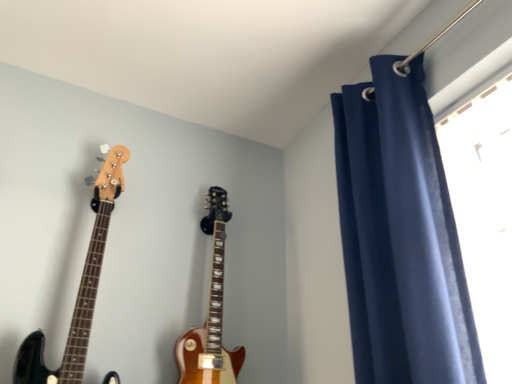
Question: From a real-world perspective, is glossy wood guitar at center, which is the 1th guitar from right to left, under glossy wood guitar at left, acting as the 1th guitar starting from the left?

Choices:
 (A) no
 (B) yes

Answer: (B)

Question: Does glossy wood guitar at center, which is the 1th guitar from right to left, have a smaller size compared to glossy wood guitar at left, the second guitar positioned from the right?

Choices:
 (A) yes
 (B) no

Answer: (A)

Question: Considering the relative sizes of glossy wood guitar at center, which is the 1th guitar from right to left, and glossy wood guitar at left, acting as the 1th guitar starting from the left, in the image provided, is glossy wood guitar at center, which is the 1th guitar from right to left, shorter than glossy wood guitar at left, acting as the 1th guitar starting from the left,?

Choices:
 (A) no
 (B) yes

Answer: (B)

Question: Is glossy wood guitar at center, marked as the 2th guitar in a left-to-right arrangement, to the right of glossy wood guitar at left, the second guitar positioned from the right, from the viewer's perspective?

Choices:
 (A) no
 (B) yes

Answer: (B)

Question: Would you say glossy wood guitar at left, acting as the 1th guitar starting from the left, is part of glossy wood guitar at center, which is the 1th guitar from right to left,'s contents?

Choices:
 (A) no
 (B) yes

Answer: (A)

Question: In the image, is glossy wood guitar at center, which is the 1th guitar from right to left, positioned in front of or behind navy blue velvet curtain at upper right?

Choices:
 (A) front
 (B) behind

Answer: (B)

Question: From their relative heights in the image, would you say glossy wood guitar at center, which is the 1th guitar from right to left, is taller or shorter than navy blue velvet curtain at upper right?

Choices:
 (A) short
 (B) tall

Answer: (A)

Question: Looking at their shapes, would you say glossy wood guitar at center, which is the 1th guitar from right to left, is wider or thinner than navy blue velvet curtain at upper right?

Choices:
 (A) thin
 (B) wide

Answer: (A)

Question: In the image, is glossy wood guitar at center, marked as the 2th guitar in a left-to-right arrangement, on the left side or the right side of navy blue velvet curtain at upper right?

Choices:
 (A) left
 (B) right

Answer: (A)

Question: From the image's perspective, is glossy wood guitar at left, the second guitar positioned from the right, located above or below navy blue velvet curtain at upper right?

Choices:
 (A) below
 (B) above

Answer: (A)

Question: Is glossy wood guitar at left, acting as the 1th guitar starting from the left, inside or outside of navy blue velvet curtain at upper right?

Choices:
 (A) outside
 (B) inside

Answer: (A)

Question: From a real-world perspective, is glossy wood guitar at left, the second guitar positioned from the right, positioned above or below navy blue velvet curtain at upper right?

Choices:
 (A) above
 (B) below

Answer: (B)

Question: Is point (75, 332) positioned closer to the camera than point (415, 337)?

Choices:
 (A) farther
 (B) closer

Answer: (A)

Question: Would you say glossy wood guitar at center, marked as the 2th guitar in a left-to-right arrangement, is inside or outside glossy wood guitar at left, acting as the 1th guitar starting from the left?

Choices:
 (A) inside
 (B) outside

Answer: (B)

Question: Is glossy wood guitar at center, marked as the 2th guitar in a left-to-right arrangement, in front of or behind glossy wood guitar at left, the second guitar positioned from the right, in the image?

Choices:
 (A) front
 (B) behind

Answer: (B)